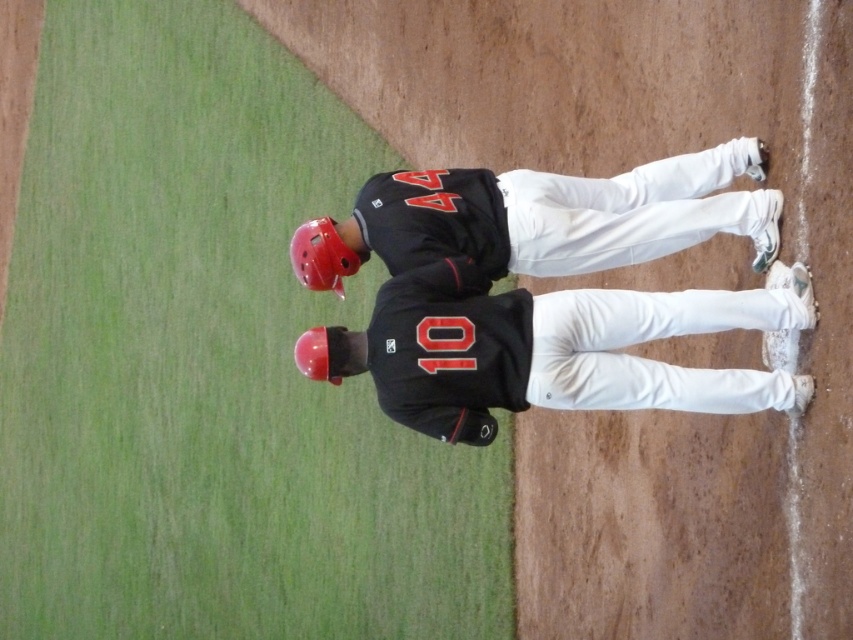
Question: Is black matte jersey at center positioned behind rubber matte baseball glove at center?

Choices:
 (A) yes
 (B) no

Answer: (B)

Question: Observing the image, what is the correct spatial positioning of black matte jersey at center in reference to rubber matte baseball glove at center?

Choices:
 (A) left
 (B) right

Answer: (B)

Question: Is black matte jersey at center wider than rubber matte baseball glove at center?

Choices:
 (A) no
 (B) yes

Answer: (B)

Question: Which of the following is the farthest from the observer?

Choices:
 (A) (728, 230)
 (B) (341, 356)

Answer: (A)

Question: Among these objects, which one is farthest from the camera?

Choices:
 (A) black matte jersey at center
 (B) rubber matte baseball glove at center

Answer: (B)

Question: Which point appears farthest from the camera in this image?

Choices:
 (A) (323, 349)
 (B) (585, 228)

Answer: (B)